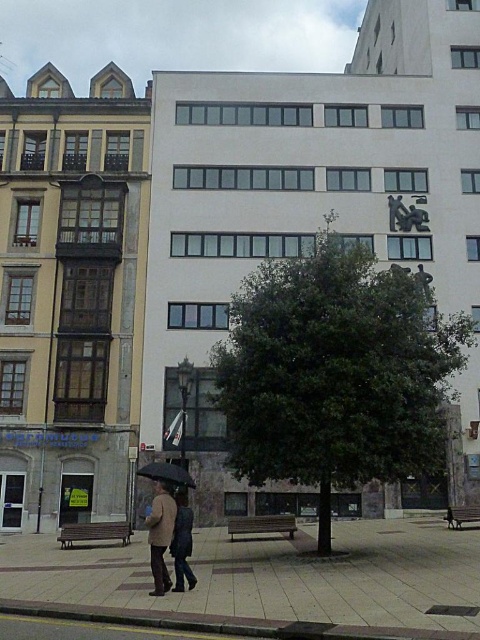
Question: Which point is farther to the camera?

Choices:
 (A) (190, 570)
 (B) (153, 525)
 (C) (141, 472)
 (D) (314, 394)

Answer: (C)

Question: Which of the following is the closest to the observer?

Choices:
 (A) smooth concrete pavement at lower center
 (B) black matte umbrella at lower center
 (C) dark blue jeans at center

Answer: (A)

Question: Does green leafy tree at center appear under black matte umbrella at lower center?

Choices:
 (A) no
 (B) yes

Answer: (A)

Question: Can you confirm if green leafy tree at center is wider than smooth concrete pavement at lower center?

Choices:
 (A) yes
 (B) no

Answer: (B)

Question: Can you confirm if brown leather jacket at center is positioned to the left of dark blue jeans at center?

Choices:
 (A) yes
 (B) no

Answer: (A)

Question: Which object is farther from the camera taking this photo?

Choices:
 (A) green leafy tree at center
 (B) brown leather jacket at center
 (C) black matte umbrella at lower center

Answer: (A)